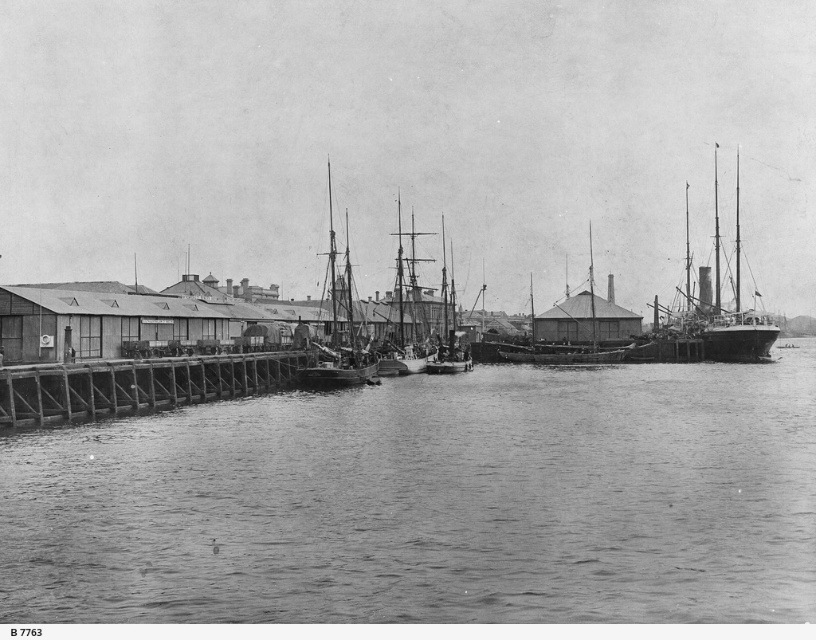
Between point (331, 323) and point (406, 337), which one is positioned behind?

Positioned behind is point (406, 337).

Does smooth wooden boat at center appear on the right side of smooth wooden ship at center?

Incorrect, smooth wooden boat at center is not on the right side of smooth wooden ship at center.

Is point (335, 340) farther from camera compared to point (415, 308)?

That is False.

Where is `smooth wooden boat at center`? smooth wooden boat at center is located at coordinates (339, 330).

Which is below, wooden ship at center or rustic wooden ship at center?

Positioned lower is rustic wooden ship at center.

Where is `wooden ship at center`? This screenshot has width=816, height=640. wooden ship at center is located at coordinates (579, 330).

Where is `wooden ship at center`? Image resolution: width=816 pixels, height=640 pixels. wooden ship at center is located at coordinates (579, 330).

Can you confirm if smooth wooden ship at center is wider than rustic wooden ship at center?

Indeed, smooth wooden ship at center has a greater width compared to rustic wooden ship at center.

Which is more to the left, smooth wooden ship at center or rustic wooden ship at center?

smooth wooden ship at center

Where is `smooth wooden ship at center`? The image size is (816, 640). smooth wooden ship at center is located at coordinates (406, 312).

Where is `smooth wooden ship at center`? This screenshot has width=816, height=640. smooth wooden ship at center is located at coordinates (406, 312).